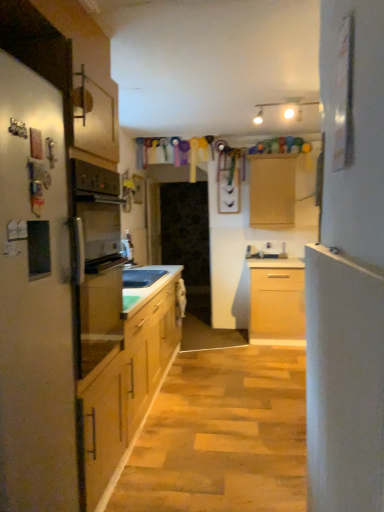
Identify the location of wooden cabinet at center. click(272, 190).

What do you see at coordinates (272, 190) in the screenshot? I see `wooden cabinet at center` at bounding box center [272, 190].

Find the location of a particular element. The height and width of the screenshot is (512, 384). matte white refrigerator at left is located at coordinates (35, 300).

Is point (4, 285) positioned before point (378, 105)?

No, it is behind (378, 105).

Find the location of a particular element. The width and height of the screenshot is (384, 512). side beneath the matte white refrigerator at left (from a real-world perspective) is located at coordinates (348, 280).

From a real-world perspective, relative to white smooth door at right, is matte white refrigerator at left vertically above or below?

matte white refrigerator at left is above white smooth door at right.

From the picture: Does matte white refrigerator at left come behind white smooth door at right?

Yes, the depth of matte white refrigerator at left is greater than that of white smooth door at right.

From the image's perspective, is wooden cabinet at center over matte white refrigerator at left?

Indeed, from the image's perspective, wooden cabinet at center is shown above matte white refrigerator at left.

Considering the sizes of objects wooden cabinet at center and matte white refrigerator at left in the image provided, who is taller, wooden cabinet at center or matte white refrigerator at left?

With more height is matte white refrigerator at left.

Is matte white refrigerator at left a part of wooden cabinet at center?

Definitely not — matte white refrigerator at left is not inside wooden cabinet at center.

Which point is more distant from viewer, [356,200] or [44,366]?

The point [44,366] is farther from the camera.

Does white smooth door at right lie behind matte white refrigerator at left?

No, the depth of white smooth door at right is less than that of matte white refrigerator at left.

Is white smooth door at right far away from matte white refrigerator at left?

No, white smooth door at right is not far away from matte white refrigerator at left.

From a real-world perspective, which is physically below, matte white refrigerator at left or wooden cabinet at center?

matte white refrigerator at left is physically lower.

Is matte white refrigerator at left placed right next to wooden cabinet at center?

No, matte white refrigerator at left is not with wooden cabinet at center.

Based on the photo, is matte white refrigerator at left at the right side of wooden cabinet at center?

In fact, matte white refrigerator at left is to the left of wooden cabinet at center.

What's the angular difference between matte white refrigerator at left and wooden cabinet at center's facing directions?

The angular difference between matte white refrigerator at left and wooden cabinet at center is 89.1 degrees.

Considering the sizes of white smooth door at right and wooden cabinet at center in the image, is white smooth door at right bigger or smaller than wooden cabinet at center?

Considering their sizes, white smooth door at right takes up less space than wooden cabinet at center.

Considering the positions of objects white smooth door at right and wooden cabinet at center in the image provided, who is behind, white smooth door at right or wooden cabinet at center?

wooden cabinet at center is further from the camera.

Does point (326, 65) come closer to viewer compared to point (270, 174)?

That is True.

Is white smooth door at right situated inside wooden cabinet at center or outside?

white smooth door at right is spatially situated outside wooden cabinet at center.

Consider the image. Considering the sizes of objects wooden cabinet at center and white smooth door at right in the image provided, who is smaller, wooden cabinet at center or white smooth door at right?

With smaller size is white smooth door at right.

From a real-world perspective, is wooden cabinet at center below white smooth door at right?

Actually, wooden cabinet at center is physically above white smooth door at right in the real world.

Considering the positions of objects wooden cabinet at center and white smooth door at right in the image provided, who is behind, wooden cabinet at center or white smooth door at right?

wooden cabinet at center is behind.

This screenshot has height=512, width=384. I want to click on side directly beneath the matte white refrigerator at left (from a real-world perspective), so click(x=348, y=280).

You are a GUI agent. You are given a task and a screenshot of the screen. Output one action in this format:
    pyautogui.click(x=<x>, y=<y>)
    Task: Click on the cabinetry behind the matte white refrigerator at left
    Image resolution: width=384 pixels, height=512 pixels.
    Given the screenshot: What is the action you would take?
    pyautogui.click(x=272, y=190)

When comparing their distances from matte white refrigerator at left, does wooden cabinet at center or white smooth door at right seem further?

Based on the image, wooden cabinet at center appears to be further to matte white refrigerator at left.

In the scene shown: When comparing their distances from wooden cabinet at center, does matte white refrigerator at left or white smooth door at right seem further?

matte white refrigerator at left lies further to wooden cabinet at center than the other object.

Based on the photo, when comparing their distances from white smooth door at right, does wooden cabinet at center or matte white refrigerator at left seem closer?

Based on the image, matte white refrigerator at left appears to be nearer to white smooth door at right.

Estimate the real-world distances between objects in this image. Which object is further from wooden cabinet at center, white smooth door at right or matte white refrigerator at left?

matte white refrigerator at left is positioned further to the anchor wooden cabinet at center.

Considering their positions, is matte white refrigerator at left positioned closer to white smooth door at right than wooden cabinet at center?

matte white refrigerator at left.

Looking at the image, which one is located further to matte white refrigerator at left, white smooth door at right or wooden cabinet at center?

Among the two, wooden cabinet at center is located further to matte white refrigerator at left.

You are a GUI agent. You are given a task and a screenshot of the screen. Output one action in this format:
    pyautogui.click(x=<x>, y=<y>)
    Task: Click on the fridge between white smooth door at right and wooden cabinet at center in the front-back direction
    
    Given the screenshot: What is the action you would take?
    pyautogui.click(x=35, y=300)